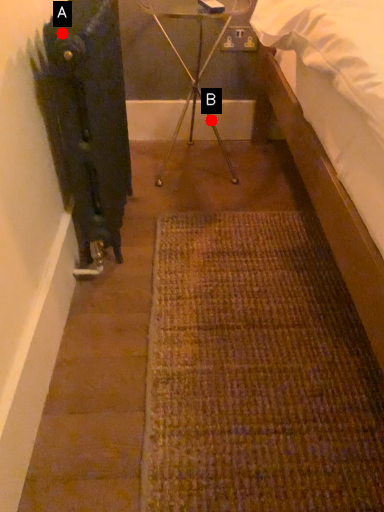
Question: Two points are circled on the image, labeled by A and B beside each circle. Which point is further to the camera?

Choices:
 (A) A is further
 (B) B is further

Answer: (B)